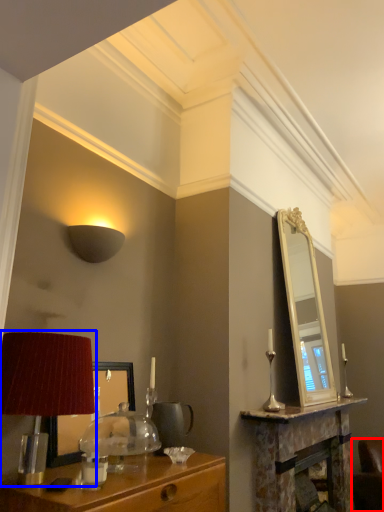
Question: Which object is closer to the camera taking this photo, swivel chair (highlighted by a red box) or table lamp (highlighted by a blue box)?

Choices:
 (A) swivel chair
 (B) table lamp

Answer: (B)